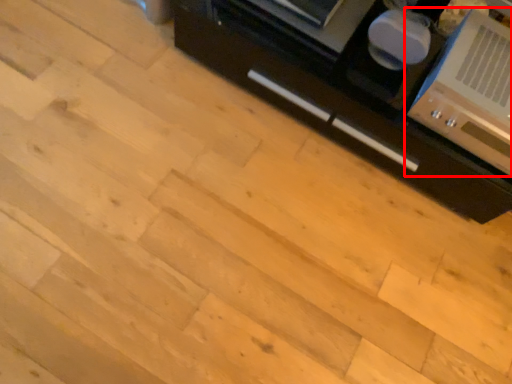
Question: From the image's perspective, what is the correct spatial positioning of home appliance (annotated by the red box) in reference to cabinetry?

Choices:
 (A) below
 (B) above

Answer: (A)